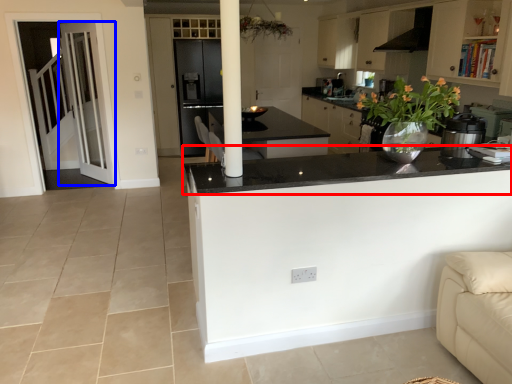
Question: Which point is further to the camera, countertop (highlighted by a red box) or door (highlighted by a blue box)?

Choices:
 (A) countertop
 (B) door

Answer: (B)